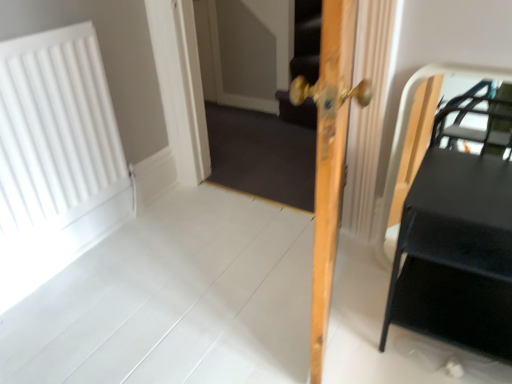
This screenshot has width=512, height=384. In order to click on vacant space underneath white matte radiator at left (from a real-world perspective) in this screenshot , I will do `click(79, 254)`.